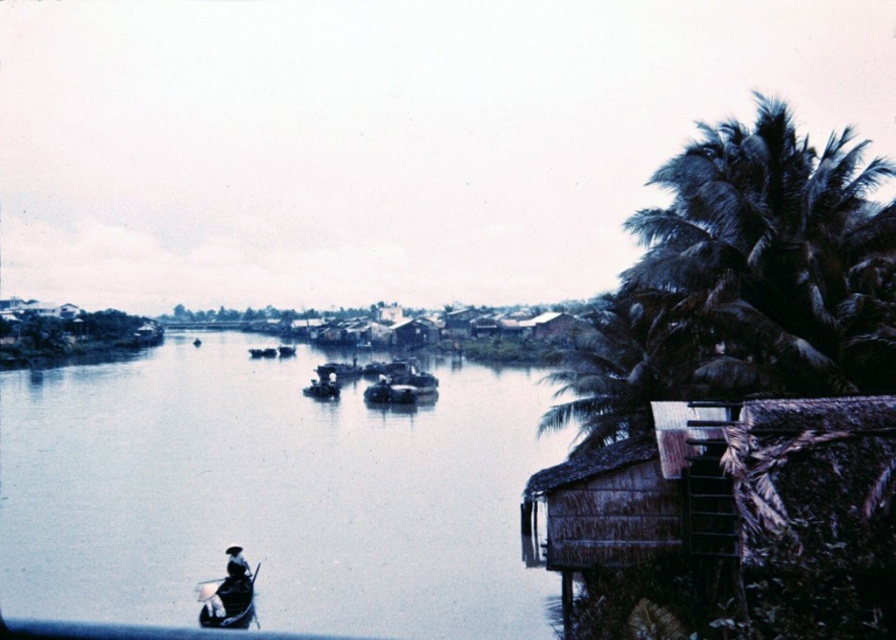
Question: Does green leafy palm tree at right have a larger size compared to wooden canoe at lower left?

Choices:
 (A) no
 (B) yes

Answer: (B)

Question: Considering the real-world distances, which object is farthest from the dark green leafy palm tree at right?

Choices:
 (A) green leafy palm tree at right
 (B) smooth water at center

Answer: (B)

Question: Among these points, which one is nearest to the camera?

Choices:
 (A) 10,504
 (B) 648,291
 (C) 790,330

Answer: (C)

Question: Where is smooth water at center located in relation to wooden canoe at lower left in the image?

Choices:
 (A) above
 (B) below

Answer: (A)

Question: Can you confirm if dark green leafy palm tree at right is bigger than wooden canoe at lower left?

Choices:
 (A) no
 (B) yes

Answer: (B)

Question: Estimate the real-world distances between objects in this image. Which object is farther from the green leafy palm tree at right?

Choices:
 (A) dark green leafy palm tree at right
 (B) smooth water at center

Answer: (B)